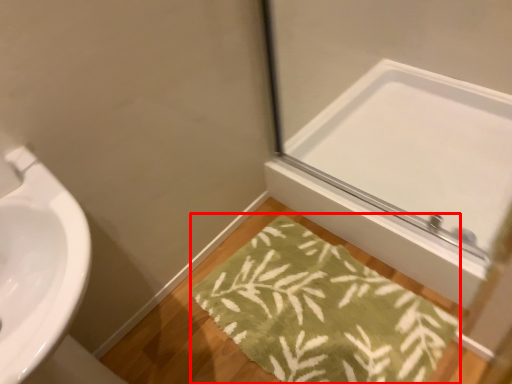
Question: From the image's perspective, what is the correct spatial relationship of bath mat (annotated by the red box) in relation to mirror?

Choices:
 (A) above
 (B) below

Answer: (B)